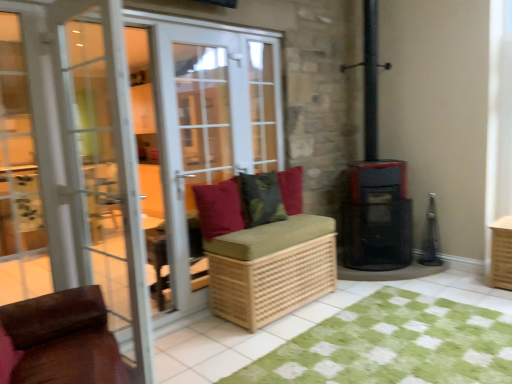
Question: Considering the relative sizes of green checkered rug at lower center and green textured cushion at center, placed as the 2th pillow when sorted from left to right, in the image provided, is green checkered rug at lower center thinner than green textured cushion at center, placed as the 2th pillow when sorted from left to right,?

Choices:
 (A) yes
 (B) no

Answer: (B)

Question: From a real-world perspective, is green checkered rug at lower center physically below green textured cushion at center, placed as the 2th pillow when sorted from left to right?

Choices:
 (A) yes
 (B) no

Answer: (A)

Question: From the image's perspective, is green checkered rug at lower center on top of green textured cushion at center, placed as the 2th pillow when sorted from right to left?

Choices:
 (A) no
 (B) yes

Answer: (A)

Question: Does green checkered rug at lower center have a greater width compared to green textured cushion at center, placed as the 2th pillow when sorted from left to right?

Choices:
 (A) yes
 (B) no

Answer: (A)

Question: Can you confirm if green checkered rug at lower center is positioned to the right of green textured cushion at center, placed as the 2th pillow when sorted from left to right?

Choices:
 (A) no
 (B) yes

Answer: (B)

Question: Is white glass screen door at left, the second screen door from the back, wider or thinner than white glass door at center?

Choices:
 (A) wide
 (B) thin

Answer: (A)

Question: Considering the positions of white glass screen door at left, the second screen door from the back, and white glass door at center in the image, is white glass screen door at left, the second screen door from the back, taller or shorter than white glass door at center?

Choices:
 (A) tall
 (B) short

Answer: (B)

Question: Is white glass screen door at left, the second screen door from the back, inside or outside of white glass door at center?

Choices:
 (A) inside
 (B) outside

Answer: (B)

Question: Is point (99, 241) positioned closer to the camera than point (195, 114)?

Choices:
 (A) closer
 (B) farther

Answer: (A)

Question: In terms of size, does white glass screen door at left, the second screen door from the back, appear bigger or smaller than woven wood bench at center?

Choices:
 (A) small
 (B) big

Answer: (A)

Question: Is white glass screen door at left, the second screen door from the back, spatially inside woven wood bench at center, or outside of it?

Choices:
 (A) outside
 (B) inside

Answer: (A)

Question: Considering the positions of white glass screen door at left, arranged as the 1th screen door when viewed from the front, and woven wood bench at center in the image, is white glass screen door at left, arranged as the 1th screen door when viewed from the front, wider or thinner than woven wood bench at center?

Choices:
 (A) wide
 (B) thin

Answer: (B)

Question: From the image's perspective, is white glass screen door at left, the second screen door from the back, positioned above or below woven wood bench at center?

Choices:
 (A) above
 (B) below

Answer: (A)

Question: From a real-world perspective, is green checkered rug at lower center positioned above or below velvet red pillow at center, the first pillow positioned from the left?

Choices:
 (A) above
 (B) below

Answer: (B)

Question: Is green checkered rug at lower center wider or thinner than velvet red pillow at center, the 3th pillow in the right-to-left sequence?

Choices:
 (A) thin
 (B) wide

Answer: (B)